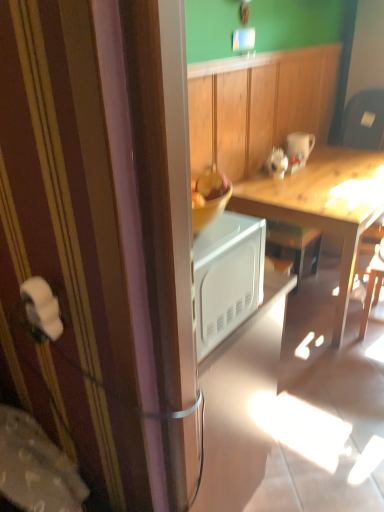
Describe the element at coordinates (323, 205) in the screenshot. The height and width of the screenshot is (512, 384). I see `wooden desk at center` at that location.

Where is `wooden desk at center`? This screenshot has height=512, width=384. wooden desk at center is located at coordinates (323, 205).

Locate an element on the screen. white glossy mug at upper right is located at coordinates (299, 148).

Measure the distance between point (299, 138) and camera.

Point (299, 138) and camera are 2.78 meters apart from each other.

Describe the element at coordinates (299, 148) in the screenshot. This screenshot has height=512, width=384. I see `white glossy mug at upper right` at that location.

The image size is (384, 512). Identify the location of wooden desk at center. (323, 205).

In the scene shown: Between white glossy mug at upper right and wooden desk at center, which one appears on the left side from the viewer's perspective?

white glossy mug at upper right is more to the left.

Which object is more forward, white glossy mug at upper right or wooden desk at center?

wooden desk at center is closer to the camera.

Between point (312, 139) and point (346, 209), which one is positioned in front?

The point (346, 209) is closer to the camera.

From the image's perspective, is white glossy mug at upper right under wooden desk at center?

No, from the image's perspective, white glossy mug at upper right is not below wooden desk at center.

From a real-world perspective, is white glossy mug at upper right over wooden desk at center?

Yes, from a real-world perspective, white glossy mug at upper right is on top of wooden desk at center.

Which object is thinner, white glossy mug at upper right or wooden desk at center?

white glossy mug at upper right is thinner.

Who is taller, white glossy mug at upper right or wooden desk at center?

wooden desk at center.

Does white glossy mug at upper right have a larger size compared to wooden desk at center?

Incorrect, white glossy mug at upper right is not larger than wooden desk at center.

Is white glossy mug at upper right not inside wooden desk at center?

white glossy mug at upper right lies outside wooden desk at center's area.

Is white glossy mug at upper right not near wooden desk at center?

They are positioned close to each other.

Is white glossy mug at upper right looking in the opposite direction of wooden desk at center?

No, white glossy mug at upper right is not facing away from wooden desk at center.

Looking at this image, can you tell me how much white glossy mug at upper right and wooden desk at center differ in facing direction?

The angle between the facing direction of white glossy mug at upper right and the facing direction of wooden desk at center is 1.21 degrees.

How much distance is there between white glossy mug at upper right and wooden desk at center?

white glossy mug at upper right and wooden desk at center are 17.16 inches apart from each other.

The height and width of the screenshot is (512, 384). What are the coordinates of `desk lying on the right of white glossy mug at upper right` in the screenshot? It's located at (323, 205).

Between wooden desk at center and white glossy mug at upper right, which one appears on the right side from the viewer's perspective?

wooden desk at center is more to the right.

Is wooden desk at center positioned before white glossy mug at upper right?

Yes, it is.

Between point (258, 175) and point (303, 138), which one is positioned in front?

The point (258, 175) is more forward.

From the image's perspective, which one is positioned higher, wooden desk at center or white glossy mug at upper right?

white glossy mug at upper right, from the image's perspective.

From a real-world perspective, is wooden desk at center positioned under white glossy mug at upper right based on gravity?

Yes, from a real-world perspective, wooden desk at center is under white glossy mug at upper right.

Which of these two, wooden desk at center or white glossy mug at upper right, is wider?

wooden desk at center is wider.

In terms of height, does wooden desk at center look taller or shorter compared to white glossy mug at upper right?

Considering their sizes, wooden desk at center has more height than white glossy mug at upper right.

Does wooden desk at center have a smaller size compared to white glossy mug at upper right?

Actually, wooden desk at center might be larger than white glossy mug at upper right.

Would you say white glossy mug at upper right is part of wooden desk at center's contents?

No, white glossy mug at upper right is located outside of wooden desk at center.

Are wooden desk at center and white glossy mug at upper right beside each other?

wooden desk at center and white glossy mug at upper right are clearly separated.

Is white glossy mug at upper right at the back of wooden desk at center?

wooden desk at center is not turned away from white glossy mug at upper right.

Find the location of a particular element. The image size is (384, 512). desk on the right of the white glossy mug at upper right is located at coordinates (323, 205).

Find the location of `desk that appears on the right of white glossy mug at upper right`. desk that appears on the right of white glossy mug at upper right is located at coordinates (323, 205).

Locate an element on the screen. This screenshot has height=512, width=384. coffee cup behind the wooden desk at center is located at coordinates (299, 148).